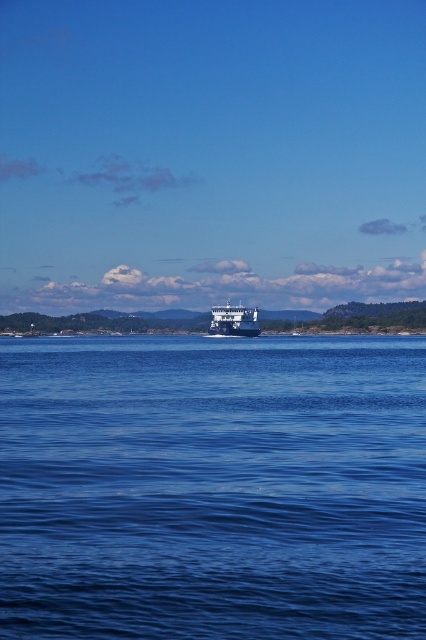
Question: Does blue liquid water at center have a greater width compared to blue metallic cruise ship at center?

Choices:
 (A) yes
 (B) no

Answer: (A)

Question: Does blue liquid water at center have a smaller size compared to blue metallic cruise ship at center?

Choices:
 (A) no
 (B) yes

Answer: (A)

Question: Which object appears closest to the camera in this image?

Choices:
 (A) blue liquid water at center
 (B) blue metallic cruise ship at center

Answer: (A)

Question: From the image, what is the correct spatial relationship of blue liquid water at center in relation to blue metallic cruise ship at center?

Choices:
 (A) left
 (B) right

Answer: (B)

Question: Among these points, which one is farthest from the camera?

Choices:
 (A) (55, 604)
 (B) (212, 321)

Answer: (B)